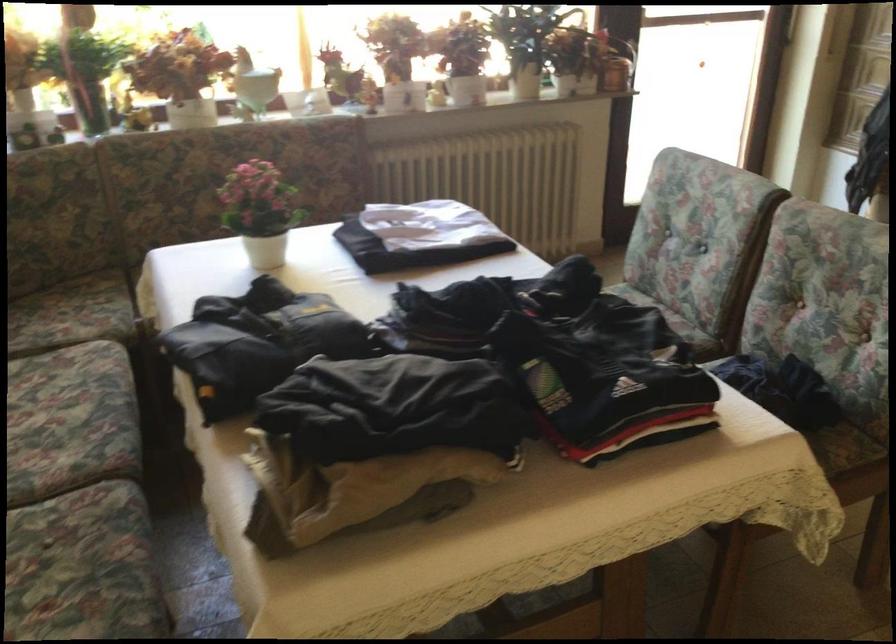
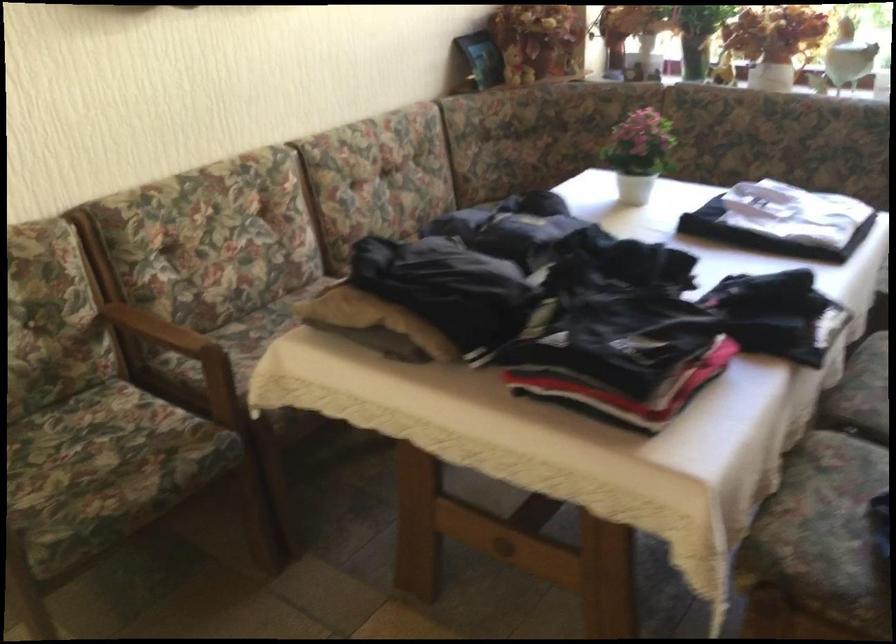
The point at (x=273, y=210) is marked in the first image. Where is the corresponding point in the second image?

(639, 153)